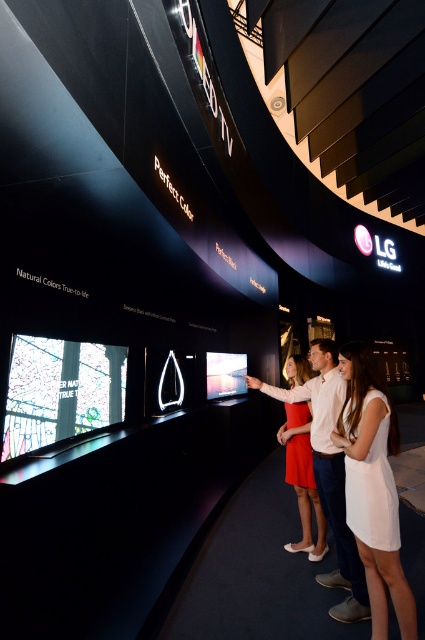
Question: Which of the following is the farthest from the observer?

Choices:
 (A) white cotton dress at center
 (B) matte red dress at center

Answer: (B)

Question: Which point is closer to the camera?

Choices:
 (A) white cotton dress at center
 (B) white cotton shirt at center

Answer: (A)

Question: Which point appears closest to the camera in this image?

Choices:
 (A) (396, 435)
 (B) (218, 378)

Answer: (A)

Question: Does white cotton dress at center have a lesser width compared to white cotton shirt at center?

Choices:
 (A) no
 (B) yes

Answer: (B)

Question: Observing the image, what is the correct spatial positioning of white cotton shirt at center in reference to matte black video game at center?

Choices:
 (A) above
 (B) below

Answer: (B)

Question: Can you confirm if white cotton dress at center is smaller than matte black video game at center?

Choices:
 (A) no
 (B) yes

Answer: (B)